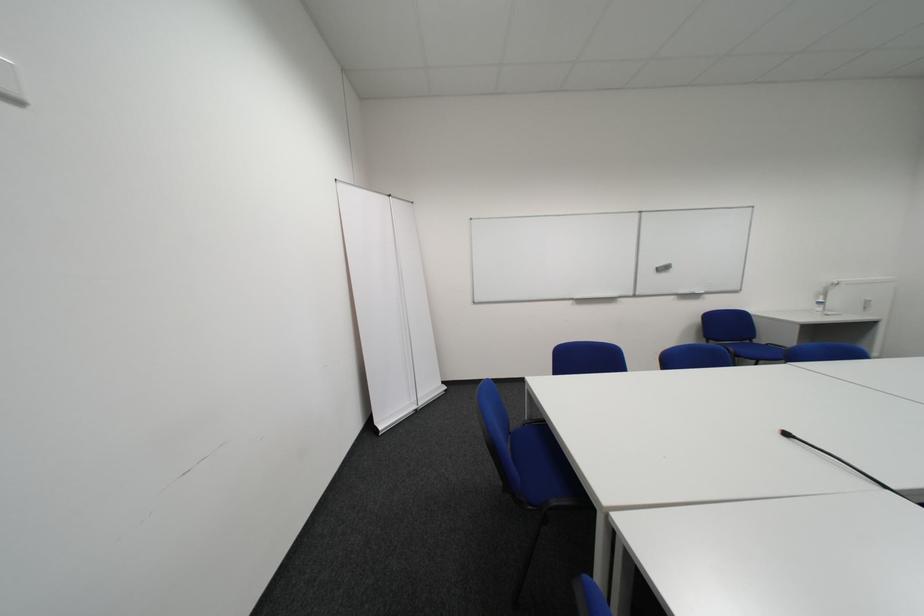
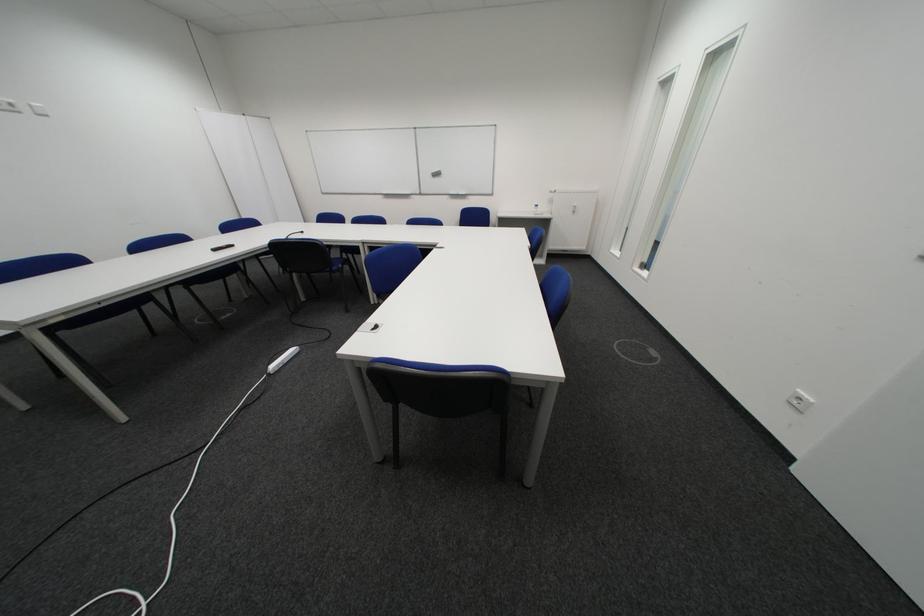
Question: I am providing you with two images of the same scene from different viewpoints. Please identify which objects are invisible in image2.

Choices:
 (A) white wall outlet
 (B) whiteboard eraser
 (C) blue chair sitting surface
 (D) grey bin lock

Answer: (C)